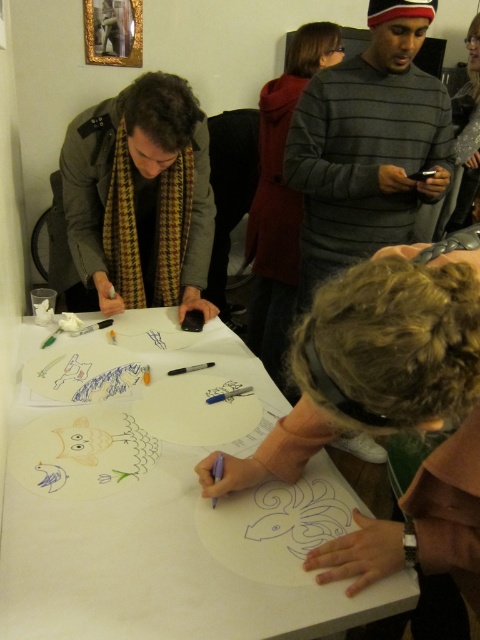
You are a photographer standing at the camera position. You want to take a closeup photo of the white paper at center. The camera can focus on objects within 25 inches. Can you capture a clear closeup without moving the camera or the paper?

The white paper at center is 30.22 inches away from the camera, which is beyond the 25 inches focus range. Therefore, you cannot capture a clear closeup without adjusting the camera or paper position.

You are standing in front of the table and want to reach both points. Which point, point (x=213, y=426) or point (x=280, y=490), is closer to you?

Point (x=213, y=426) is closer to you because it is further to the camera than point (x=280, y=490).

You are organizing a drawing activity for children and have a blue ink fish at center that needs to be placed on the white paper at center. According to the image, is there enough space between them to attach the fish to the paper?

The white paper at center is 10.16 inches away from the blue ink fish at center, so there is sufficient space to attach the fish to the paper since the distance allows for placement without overlapping.